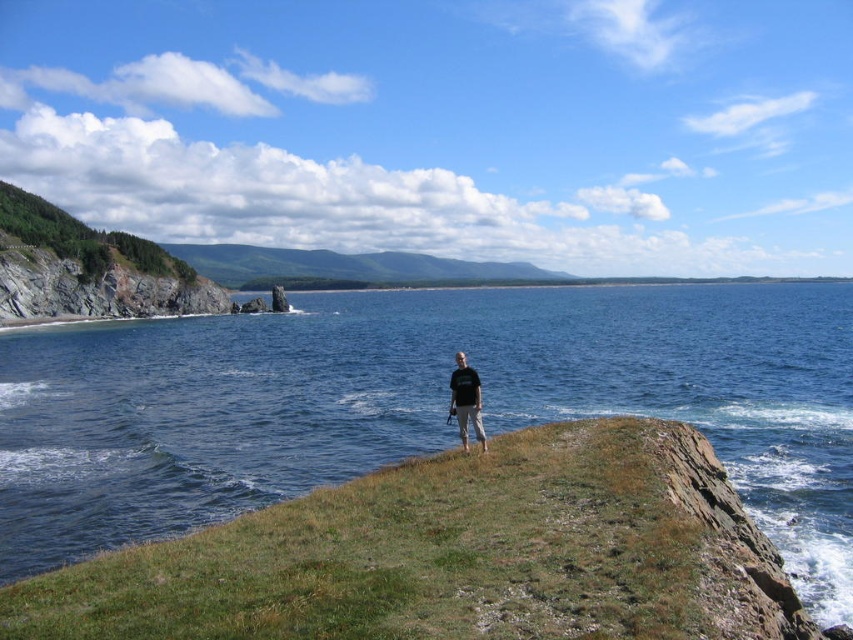
Can you confirm if rocky cliff at left is positioned to the left of black cotton shirt at center?

Yes, rocky cliff at left is to the left of black cotton shirt at center.

The image size is (853, 640). Identify the location of rocky cliff at left. (94, 269).

In order to click on rocky cliff at left in this screenshot , I will do `click(94, 269)`.

Is point (215, 381) positioned behind point (177, 276)?

No, (215, 381) is in front of (177, 276).

Can you confirm if blue water at center is positioned below rocky cliff at left?

Correct, blue water at center is located below rocky cliff at left.

Find the location of a particular element. blue water at center is located at coordinates (421, 404).

Where is `blue water at center`? The height and width of the screenshot is (640, 853). blue water at center is located at coordinates (421, 404).

Does blue water at center appear under black cotton shirt at center?

Actually, blue water at center is above black cotton shirt at center.

Which is more to the right, blue water at center or black cotton shirt at center?

From the viewer's perspective, blue water at center appears more on the right side.

Where is `blue water at center`? Image resolution: width=853 pixels, height=640 pixels. blue water at center is located at coordinates (421, 404).